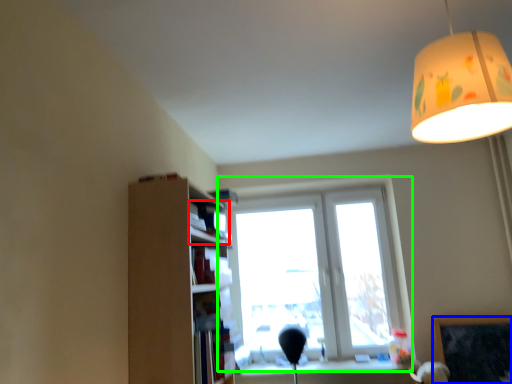
Question: Based on their relative distances, which object is farther from book (highlighted by a red box)? Choose from bulletin board (highlighted by a blue box) and window (highlighted by a green box).

Choices:
 (A) bulletin board
 (B) window

Answer: (A)